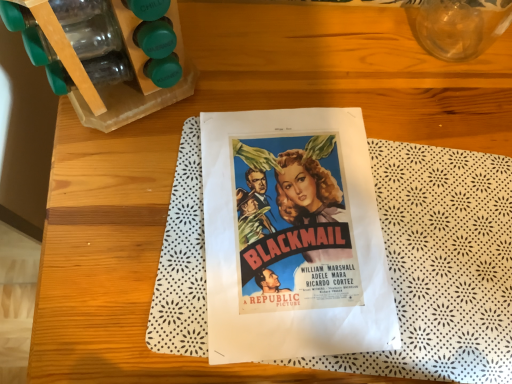
You are a GUI agent. You are given a task and a screenshot of the screen. Output one action in this format:
    pyautogui.click(x=<x>, y=<y>)
    Task: Click on the free location to the right of vivid paper poster at center
    
    Given the screenshot: What is the action you would take?
    pyautogui.click(x=444, y=243)